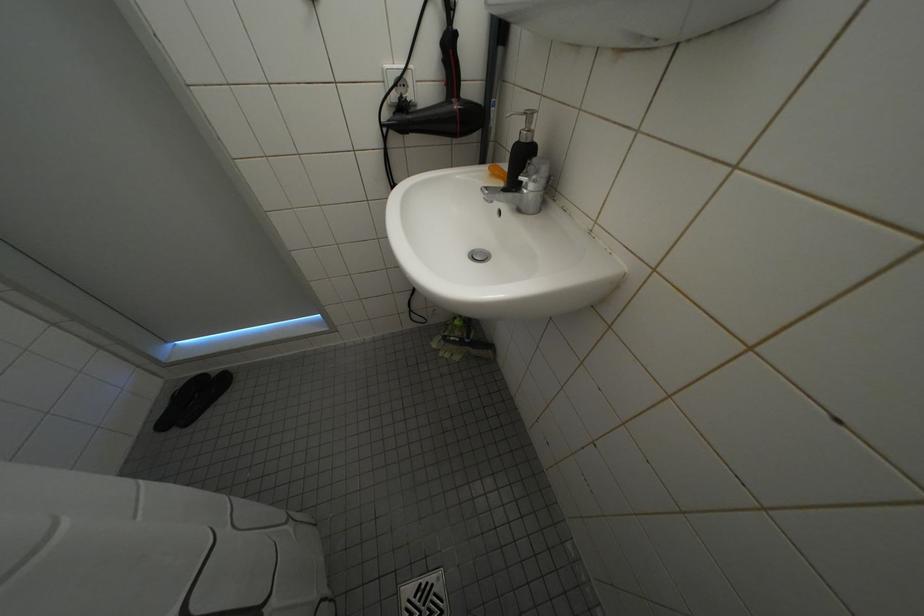
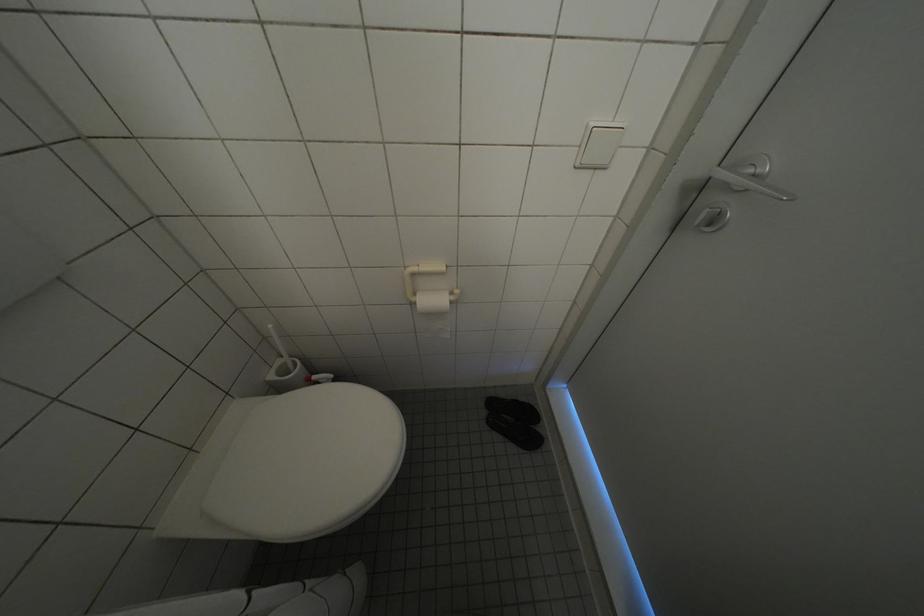
The first image is from the beginning of the video and the second image is from the end. How did the camera likely rotate when shooting the video?

The camera rotated toward left-down.